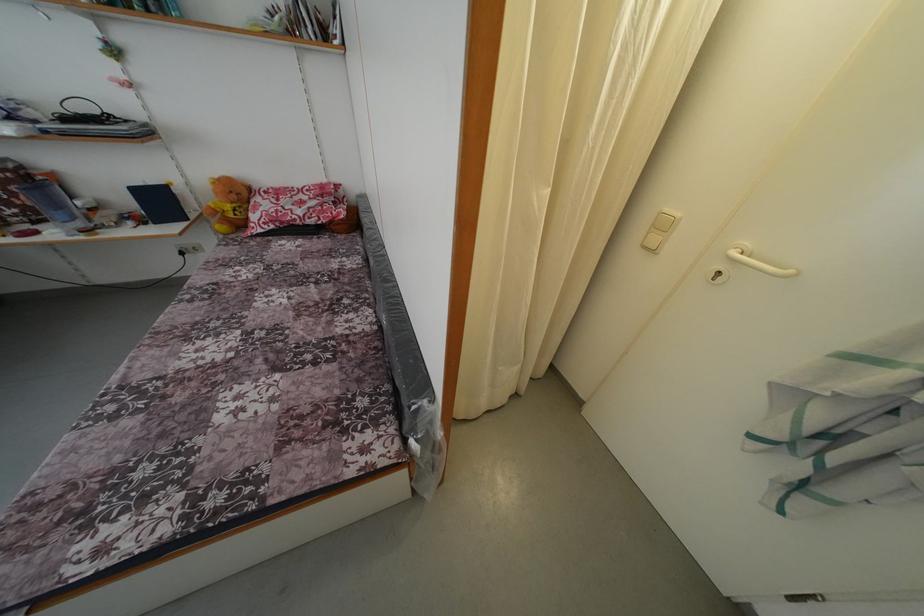
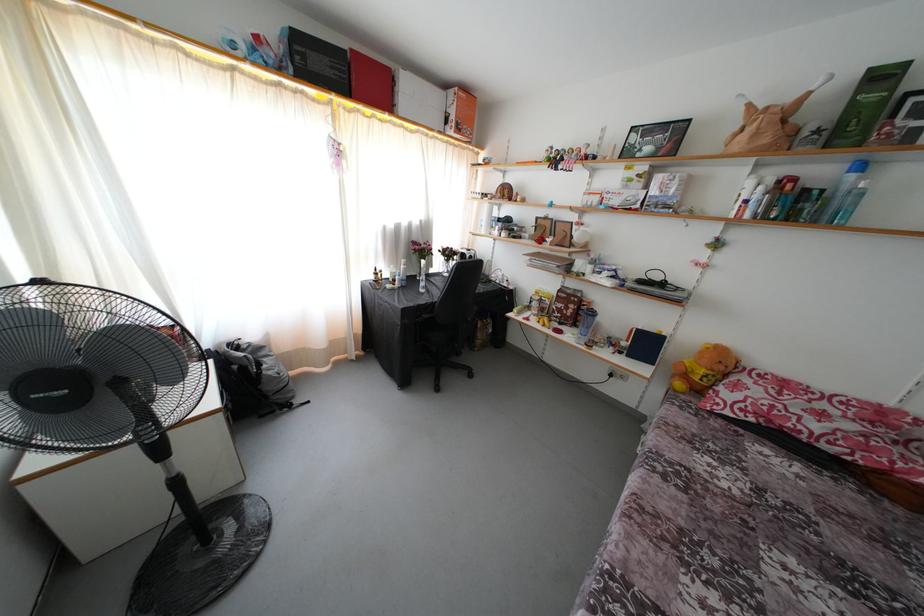
Question: The camera is either moving clockwise (left) or counter-clockwise (right) around the object. The first image is from the beginning of the video and the second image is from the end. Is the camera moving left or right when shooting the video?

Choices:
 (A) Left
 (B) Right

Answer: (B)